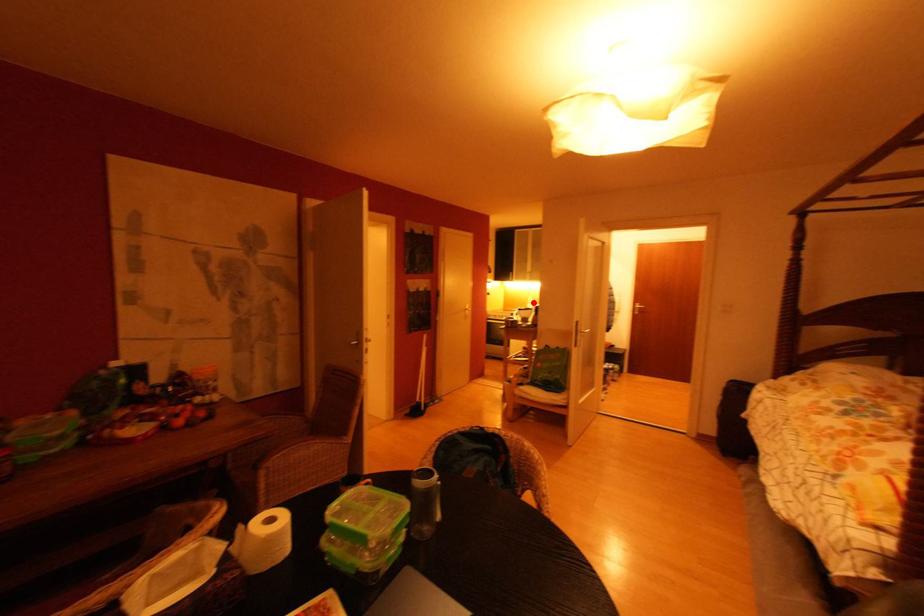
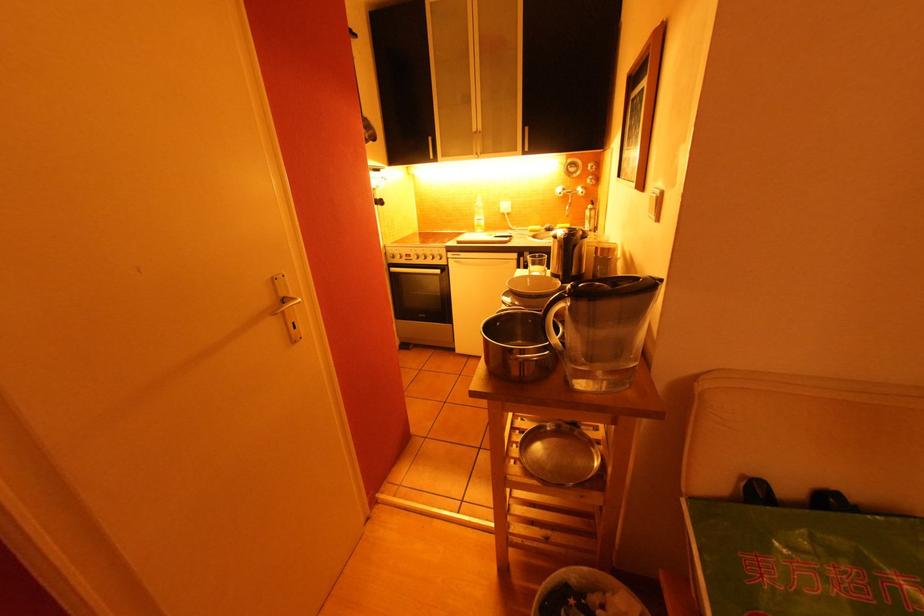
Question: I am providing you with two images of the same scene from different viewpoints. A red point is shown in image1. For the corresponding object point in image2, is it positioned nearer or farther from the camera?

Choices:
 (A) Nearer
 (B) Farther

Answer: (A)